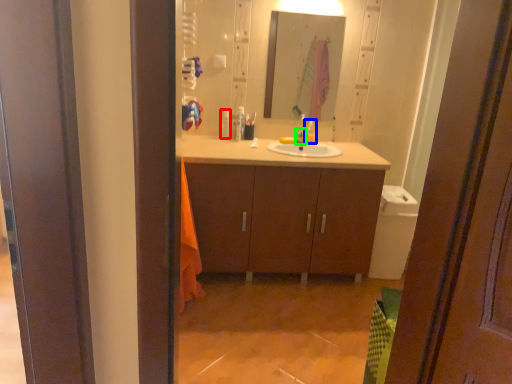
Question: Considering the real-world distances, which object is closest to toiletry (highlighted by a red box)? toiletry (highlighted by a blue box) or tap (highlighted by a green box).

Choices:
 (A) toiletry
 (B) tap

Answer: (B)